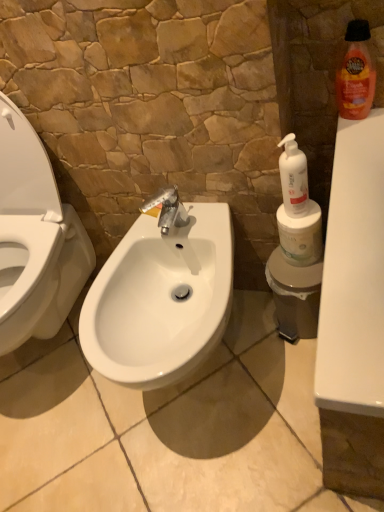
Locate an element on the screen. white glossy bidet at center is located at coordinates (35, 238).

What do you see at coordinates (35, 238) in the screenshot?
I see `white glossy bidet at center` at bounding box center [35, 238].

What do you see at coordinates (355, 72) in the screenshot? I see `orange glossy bottle at upper right, acting as the first cleaning product starting from the right` at bounding box center [355, 72].

The image size is (384, 512). Describe the element at coordinates (301, 234) in the screenshot. I see `white matte toilet paper at right` at that location.

You are a GUI agent. You are given a task and a screenshot of the screen. Output one action in this format:
    pyautogui.click(x=<x>, y=<y>)
    Task: Click on the white glossy bidet at center
    The height and width of the screenshot is (512, 384).
    Given the screenshot: What is the action you would take?
    pyautogui.click(x=35, y=238)

Can you see white plastic pump bottle at right, marked as the second cleaning product in a top-to-bottom arrangement, touching white matte toilet paper at right?

Yes, white plastic pump bottle at right, marked as the second cleaning product in a top-to-bottom arrangement, is in contact with white matte toilet paper at right.

Which is in front, point (294, 147) or point (281, 231)?

Positioned in front is point (294, 147).

From the image's perspective, is white plastic pump bottle at right, marked as the second cleaning product in a top-to-bottom arrangement, on top of white matte toilet paper at right?

Yes.

Between white plastic pump bottle at right, acting as the 1th cleaning product starting from the left, and white matte toilet paper at right, which one appears on the right side from the viewer's perspective?

Positioned to the right is white matte toilet paper at right.

Looking at this image, how many degrees apart are the facing directions of white matte toilet paper at right and white glossy bidet at center?

There is a 0.191-degree angle between the facing directions of white matte toilet paper at right and white glossy bidet at center.

From a real-world perspective, is white matte toilet paper at right located higher than white glossy bidet at center?

No.

Does white matte toilet paper at right have a greater height compared to white glossy bidet at center?

No.

Which object is positioned more to the right, white matte toilet paper at right or white glossy bidet at center?

white matte toilet paper at right is more to the right.

Can you confirm if white glossy bidet at center is positioned to the left of white plastic pump bottle at right, which is the first cleaning product in bottom-to-top order?

Yes.

Can you tell me how much white glossy bidet at center and white plastic pump bottle at right, marked as the second cleaning product in a top-to-bottom arrangement, differ in facing direction?

The angular difference between white glossy bidet at center and white plastic pump bottle at right, marked as the second cleaning product in a top-to-bottom arrangement, is 2.67 degrees.

In terms of width, does white glossy bidet at center look wider or thinner when compared to white plastic pump bottle at right, which is the first cleaning product in bottom-to-top order?

Considering their sizes, white glossy bidet at center looks broader than white plastic pump bottle at right, which is the first cleaning product in bottom-to-top order.

Which point is more forward, (209, 302) or (287, 190)?

The point (287, 190) is closer.

Which of these two, white glossy sink at center or white plastic pump bottle at right, arranged as the second cleaning product when viewed from the right, is thinner?

With smaller width is white plastic pump bottle at right, arranged as the second cleaning product when viewed from the right.

Is white glossy sink at center closer to the viewer compared to white plastic pump bottle at right, which is the first cleaning product in bottom-to-top order?

Yes, it is in front of white plastic pump bottle at right, which is the first cleaning product in bottom-to-top order.

Between white glossy sink at center and white plastic pump bottle at right, arranged as the second cleaning product when viewed from the right, which one has more height?

white glossy sink at center.

Which is closer to the camera, (26, 203) or (361, 46)?

Point (26, 203) is positioned farther from the camera compared to point (361, 46).

Is white glossy bidet at center spatially inside orange glossy bottle at upper right, the 2th cleaning product from the bottom, or outside of it?

white glossy bidet at center is located beyond the bounds of orange glossy bottle at upper right, the 2th cleaning product from the bottom.

Where is `toilet on the left of orange glossy bottle at upper right, the 2th cleaning product from the bottom`? toilet on the left of orange glossy bottle at upper right, the 2th cleaning product from the bottom is located at coordinates (35, 238).

Is white glossy bidet at center touching orange glossy bottle at upper right, the 2th cleaning product from the bottom?

No, white glossy bidet at center is not with orange glossy bottle at upper right, the 2th cleaning product from the bottom.

Based on the photo, is orange glossy bottle at upper right, placed as the second cleaning product when sorted from left to right, oriented away from white glossy sink at center?

No, white glossy sink at center is not at the back of orange glossy bottle at upper right, placed as the second cleaning product when sorted from left to right.

From a real-world perspective, starting from the white glossy sink at center, which cleaning product is the 2nd one vertically above it? Please provide its 2D coordinates.

[(355, 72)]

In terms of size, does orange glossy bottle at upper right, the 1th cleaning product when ordered from top to bottom, appear bigger or smaller than white glossy sink at center?

Clearly, orange glossy bottle at upper right, the 1th cleaning product when ordered from top to bottom, is smaller in size than white glossy sink at center.

From a real-world perspective, which is physically below, orange glossy bottle at upper right, placed as the second cleaning product when sorted from left to right, or white glossy sink at center?

In real-world perspective, white glossy sink at center is lower.

How different are the orientations of orange glossy bottle at upper right, placed as the second cleaning product when sorted from left to right, and white glossy bidet at center in degrees?

0.947 degrees.

I want to click on toilet on the left of the orange glossy bottle at upper right, acting as the first cleaning product starting from the right, so click(x=35, y=238).

Is orange glossy bottle at upper right, the 2th cleaning product from the bottom, smaller than white glossy bidet at center?

Correct, orange glossy bottle at upper right, the 2th cleaning product from the bottom, occupies less space than white glossy bidet at center.

Can we say orange glossy bottle at upper right, the 2th cleaning product from the bottom, lies outside white glossy bidet at center?

Absolutely, orange glossy bottle at upper right, the 2th cleaning product from the bottom, is external to white glossy bidet at center.

This screenshot has width=384, height=512. I want to click on cleaning product that is the 1st object above the white matte toilet paper at right (from a real-world perspective), so click(x=293, y=178).

What are the coordinates of `toilet paper above the white glossy bidet at center (from the image's perspective)` in the screenshot? It's located at (301, 234).

Which object lies further to the anchor point white plastic pump bottle at right, marked as the second cleaning product in a top-to-bottom arrangement, white glossy bidet at center or white matte toilet paper at right?

white glossy bidet at center.

Looking at the image, which one is located further to white matte toilet paper at right, white plastic pump bottle at right, marked as the second cleaning product in a top-to-bottom arrangement, or orange glossy bottle at upper right, acting as the first cleaning product starting from the right?

orange glossy bottle at upper right, acting as the first cleaning product starting from the right, lies further to white matte toilet paper at right than the other object.

Estimate the real-world distances between objects in this image. Which object is closer to white glossy bidet at center, white matte toilet paper at right or orange glossy bottle at upper right, the 1th cleaning product when ordered from top to bottom?

white matte toilet paper at right is positioned closer to the anchor white glossy bidet at center.

From the image, which object appears to be farther from orange glossy bottle at upper right, placed as the second cleaning product when sorted from left to right, white plastic pump bottle at right, marked as the second cleaning product in a top-to-bottom arrangement, or white glossy bidet at center?

white glossy bidet at center lies further to orange glossy bottle at upper right, placed as the second cleaning product when sorted from left to right, than the other object.

Considering their positions, is orange glossy bottle at upper right, the 1th cleaning product when ordered from top to bottom, positioned closer to white matte toilet paper at right than white glossy sink at center?

orange glossy bottle at upper right, the 1th cleaning product when ordered from top to bottom, is positioned closer to the anchor white matte toilet paper at right.

Looking at the image, which one is located further to white glossy sink at center, white plastic pump bottle at right, acting as the 1th cleaning product starting from the left, or white matte toilet paper at right?

white plastic pump bottle at right, acting as the 1th cleaning product starting from the left, is positioned further to the anchor white glossy sink at center.

Which object lies nearer to the anchor point white glossy sink at center, orange glossy bottle at upper right, placed as the second cleaning product when sorted from left to right, or white glossy bidet at center?

Among the two, white glossy bidet at center is located nearer to white glossy sink at center.

When comparing their distances from orange glossy bottle at upper right, placed as the second cleaning product when sorted from left to right, does white plastic pump bottle at right, which is the first cleaning product in bottom-to-top order, or white matte toilet paper at right seem closer?

white plastic pump bottle at right, which is the first cleaning product in bottom-to-top order, is positioned closer to the anchor orange glossy bottle at upper right, placed as the second cleaning product when sorted from left to right.

Find the location of a particular element. toilet paper between white plastic pump bottle at right, arranged as the second cleaning product when viewed from the right, and white glossy sink at center vertically is located at coordinates (301, 234).

This screenshot has width=384, height=512. Identify the location of toilet paper between white glossy bidet at center and orange glossy bottle at upper right, placed as the second cleaning product when sorted from left to right, in the horizontal direction. (301, 234).

This screenshot has height=512, width=384. In order to click on cleaning product between white glossy bidet at center and orange glossy bottle at upper right, placed as the second cleaning product when sorted from left to right, from left to right in this screenshot , I will do `click(293, 178)`.

The height and width of the screenshot is (512, 384). Find the location of `toilet paper between orange glossy bottle at upper right, the 2th cleaning product from the bottom, and white glossy sink at center, in the vertical direction`. toilet paper between orange glossy bottle at upper right, the 2th cleaning product from the bottom, and white glossy sink at center, in the vertical direction is located at coordinates (301, 234).